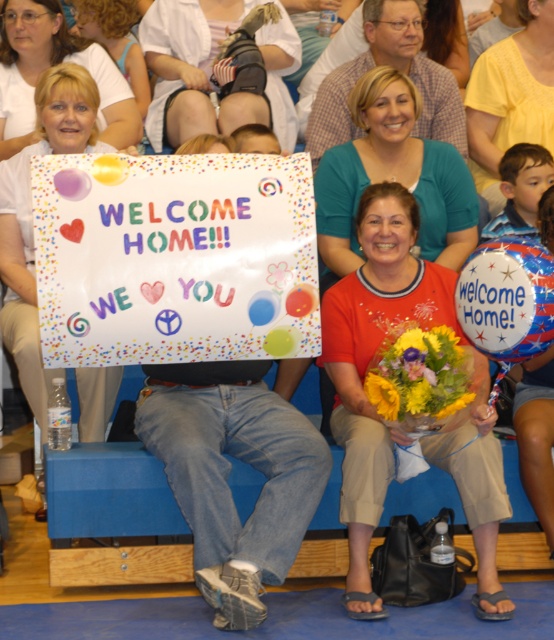
You are standing at a distance of 10 meters from the scene. If you move forward 0.5 meters, will you be closer to the point at coordinates point [145,52] than before?

The point at coordinates point [145,52] is 9.43 meters away from the viewer. Moving forward 0.5 meters reduces your distance to 9.5 meters, so you will be slightly closer to the point at coordinates point 0.084, [145,52] than before.

You are a photographer trying to capture the celebratory scene. The scene has a point marked at coordinates point (371, 358). Can you describe what is located at that point?

The point (371, 358) indicates the location of the matte red shirt at center.